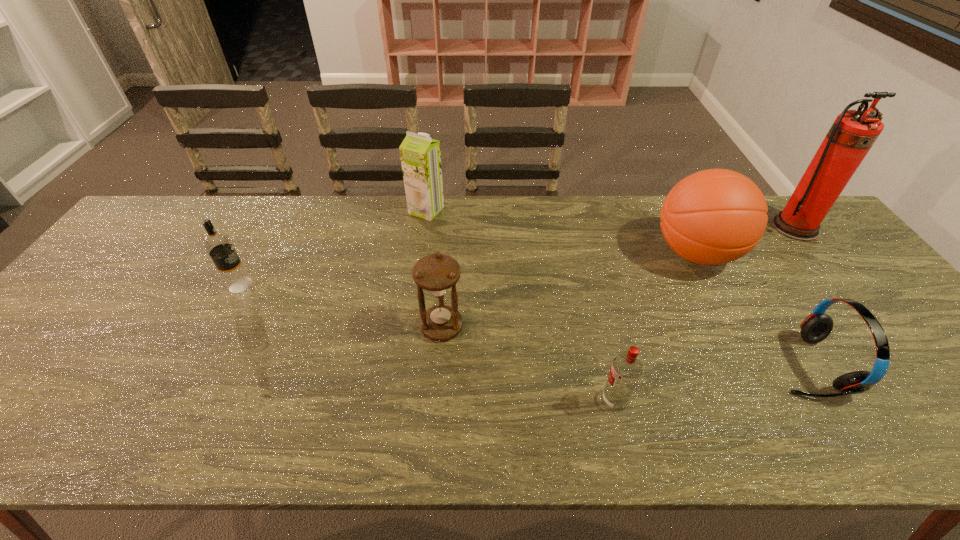
Where is `the closest object to the hourglass`? the closest object to the hourglass is located at coordinates (626, 369).

Locate which object ranks third in proximity to the fourth object from right to left. Please provide its 2D coordinates. Your answer should be formatted as a tuple, i.e. [(x, y)], where the tuple contains the x and y coordinates of a point satisfying the conditions above.

[(715, 216)]

This screenshot has width=960, height=540. I want to click on free spot that satisfies the following two spatial constraints: 1. on the label of the left vodka; 2. on the left side of the hourglass, so click(x=218, y=327).

The height and width of the screenshot is (540, 960). In order to click on vacant region that satisfies the following two spatial constraints: 1. on the label of the hourglass; 2. on the right side of the farther vodka in this screenshot , I will do `click(218, 327)`.

Where is `free location that satisfies the following two spatial constraints: 1. at the discharge end of the tallest object; 2. with the microphone attached to the side of the headset`? This screenshot has width=960, height=540. free location that satisfies the following two spatial constraints: 1. at the discharge end of the tallest object; 2. with the microphone attached to the side of the headset is located at coordinates (905, 365).